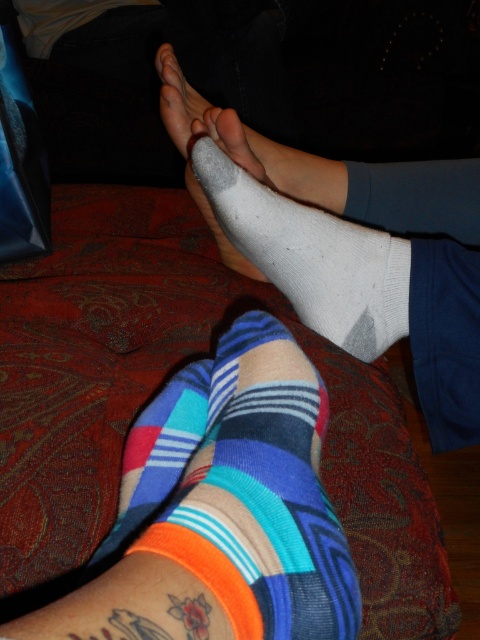
In order to click on white cotton sock at center in this screenshot , I will do `click(312, 257)`.

Which is below, white cotton sock at center or white matte sock at center?

white cotton sock at center

Is point (324, 323) closer to viewer compared to point (167, 97)?

That is True.

Locate an element on the screen. The image size is (480, 640). white cotton sock at center is located at coordinates (312, 257).

Does multicolored fabric socks at lower center have a smaller size compared to white matte sock at center?

Indeed, multicolored fabric socks at lower center has a smaller size compared to white matte sock at center.

Which is in front, point (144, 554) or point (252, 144)?

Point (144, 554) is in front.

I want to click on multicolored fabric socks at lower center, so click(220, 509).

Is multicolored fabric socks at lower center further to camera compared to white cotton sock at center?

No, multicolored fabric socks at lower center is closer to the viewer.

Is multicolored fabric socks at lower center to the left of white cotton sock at center from the viewer's perspective?

Indeed, multicolored fabric socks at lower center is positioned on the left side of white cotton sock at center.

Which is in front, point (278, 380) or point (358, 321)?

Point (278, 380)

Where is `multicolored fabric socks at lower center`? This screenshot has width=480, height=640. multicolored fabric socks at lower center is located at coordinates (220, 509).